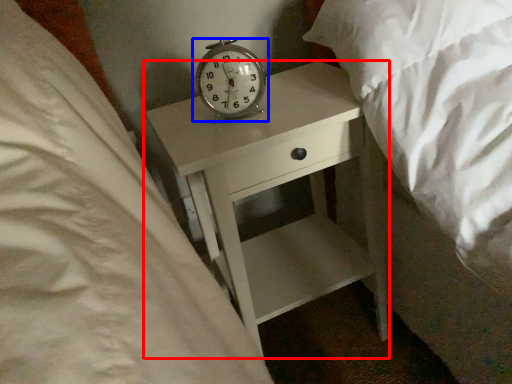
Question: Which object is further to the camera taking this photo, nightstand (highlighted by a red box) or alarm clock (highlighted by a blue box)?

Choices:
 (A) nightstand
 (B) alarm clock

Answer: (B)